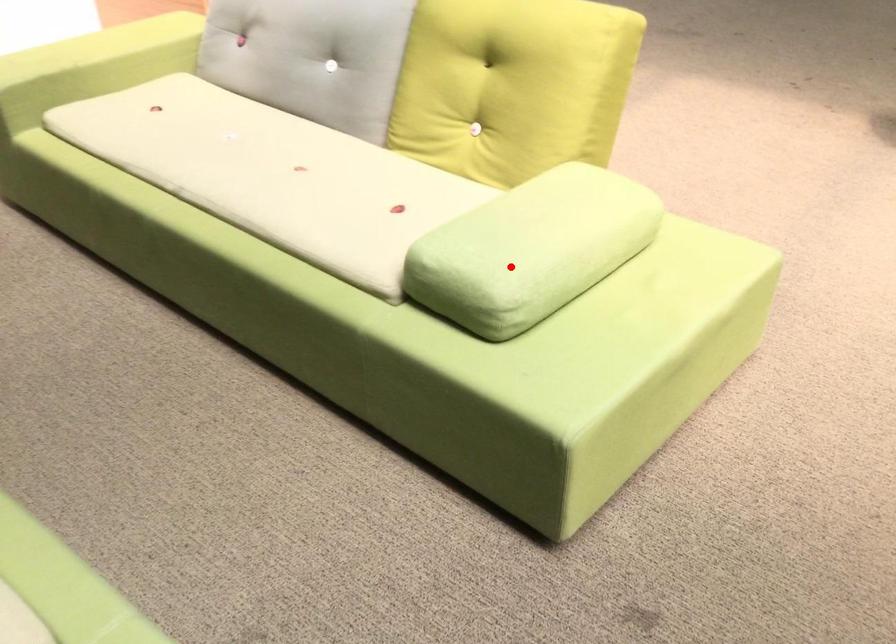
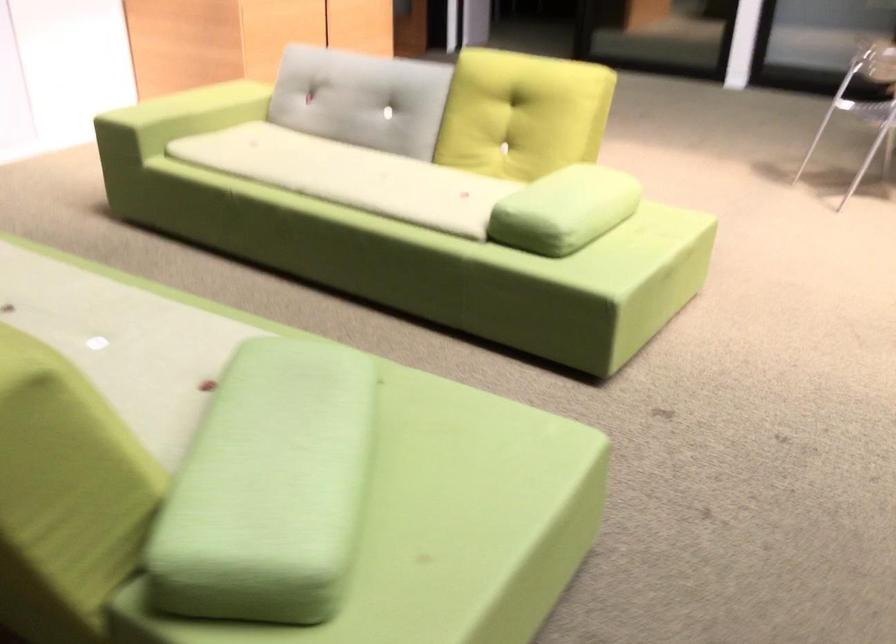
The point at the highlighted location is marked in the first image. Where is the corresponding point in the second image?

(564, 210)